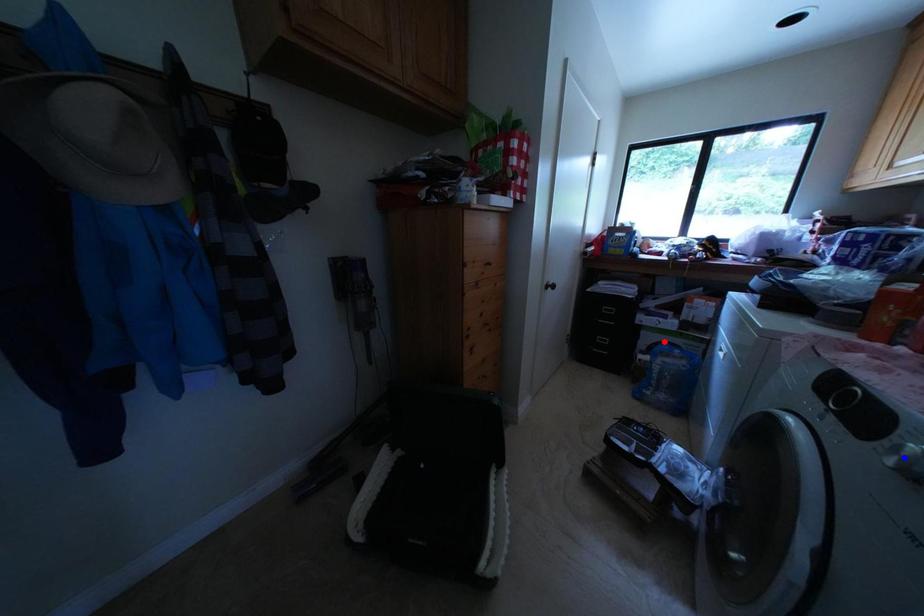
Question: In the image, two points are highlighted. Which point is nearer to the camera? Reply with the corresponding letter.

Choices:
 (A) blue point
 (B) red point

Answer: (A)